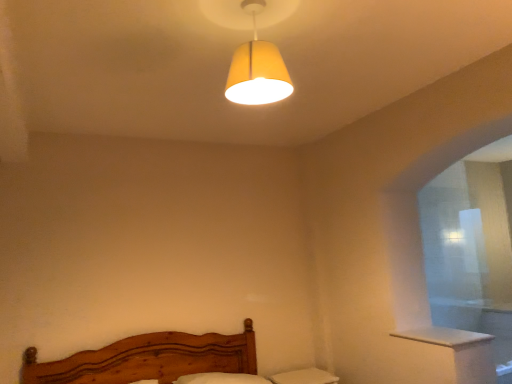
Question: Can you confirm if matte yellow fabric lampshade at upper center is thinner than white wood window sill at lower right?

Choices:
 (A) no
 (B) yes

Answer: (B)

Question: Does matte yellow fabric lampshade at upper center come behind white wood window sill at lower right?

Choices:
 (A) no
 (B) yes

Answer: (A)

Question: Would you say matte yellow fabric lampshade at upper center is a long distance from white wood window sill at lower right?

Choices:
 (A) no
 (B) yes

Answer: (B)

Question: Is matte yellow fabric lampshade at upper center shorter than white wood window sill at lower right?

Choices:
 (A) no
 (B) yes

Answer: (A)

Question: From a real-world perspective, is matte yellow fabric lampshade at upper center below white wood window sill at lower right?

Choices:
 (A) yes
 (B) no

Answer: (B)

Question: Is matte yellow fabric lampshade at upper center oriented towards white wood window sill at lower right?

Choices:
 (A) yes
 (B) no

Answer: (B)

Question: From a real-world perspective, is white wood window sill at lower right on top of matte yellow fabric lampshade at upper center?

Choices:
 (A) yes
 (B) no

Answer: (B)

Question: Does white wood window sill at lower right have a greater height compared to matte yellow fabric lampshade at upper center?

Choices:
 (A) no
 (B) yes

Answer: (A)

Question: Is white wood window sill at lower right behind matte yellow fabric lampshade at upper center?

Choices:
 (A) yes
 (B) no

Answer: (A)

Question: Is white wood window sill at lower right positioned with its back to matte yellow fabric lampshade at upper center?

Choices:
 (A) yes
 (B) no

Answer: (B)

Question: From the image's perspective, would you say white wood window sill at lower right is positioned over matte yellow fabric lampshade at upper center?

Choices:
 (A) yes
 (B) no

Answer: (B)

Question: Would you say white wood window sill at lower right contains matte yellow fabric lampshade at upper center?

Choices:
 (A) yes
 (B) no

Answer: (B)

Question: Based on their sizes in the image, would you say matte yellow fabric lampshade at upper center is bigger or smaller than white wood window sill at lower right?

Choices:
 (A) small
 (B) big

Answer: (B)